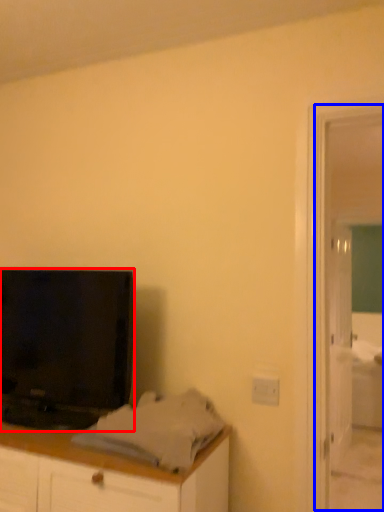
Question: Which point is closer to the camera, television (highlighted by a red box) or screen door (highlighted by a blue box)?

Choices:
 (A) television
 (B) screen door

Answer: (A)